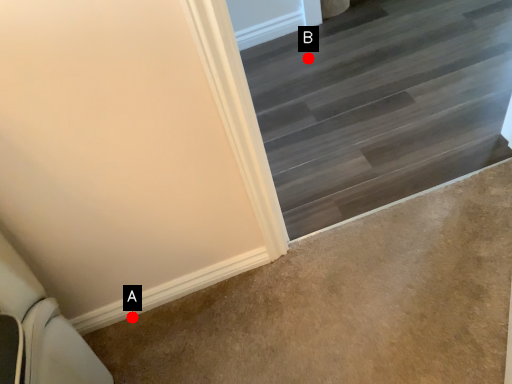
Question: Two points are circled on the image, labeled by A and B beside each circle. Which of the following is the farthest from the observer?

Choices:
 (A) A is further
 (B) B is further

Answer: (B)